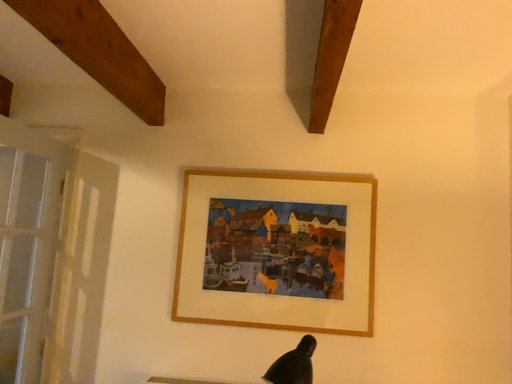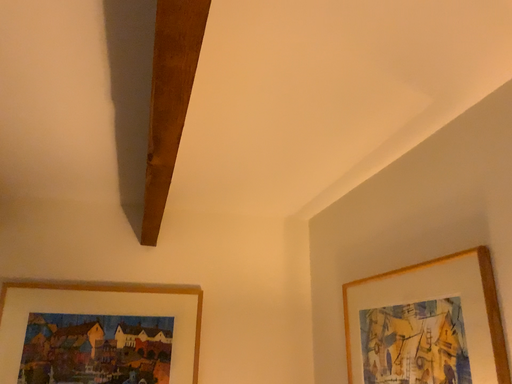
Question: Which way did the camera rotate in the video?

Choices:
 (A) rotated upward
 (B) rotated downward

Answer: (A)